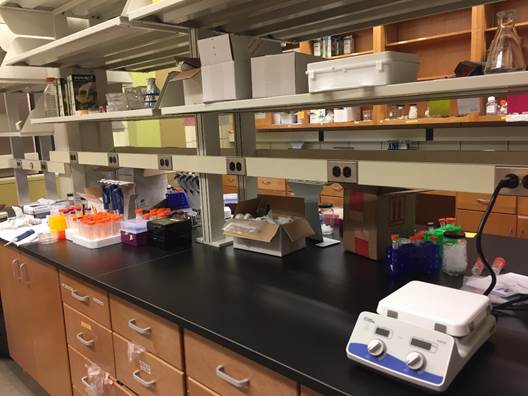
Where is `plastic protruding from drawers`? The image size is (528, 396). plastic protruding from drawers is located at coordinates (134, 352), (92, 376).